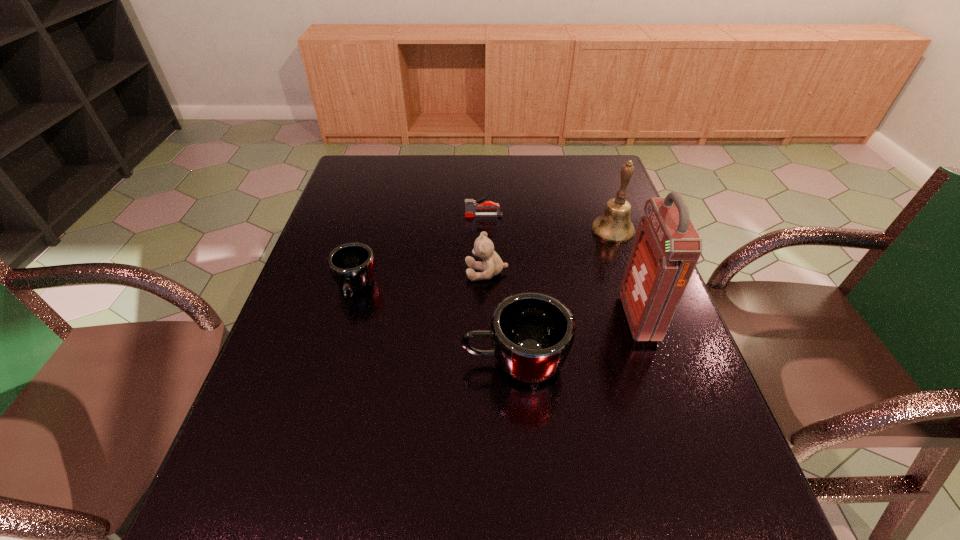
At what (x,y) coordinates should I click in order to perform the action: click on blank space that satisfies the following two spatial constraints: 1. on the front side of the second tallest object; 2. on the side of the nearer mug with the handle. Please return your answer as a coordinate pair (x, y). This screenshot has height=540, width=960. Looking at the image, I should click on (660, 362).

Identify the location of vacant region that satisfies the following two spatial constraints: 1. on the face of the teddy bear; 2. on the side of the left mug with the handle. The height and width of the screenshot is (540, 960). click(x=487, y=288).

The height and width of the screenshot is (540, 960). Identify the location of free location that satisfies the following two spatial constraints: 1. on the handle side of the stapler; 2. on the back side of the bell. (484, 230).